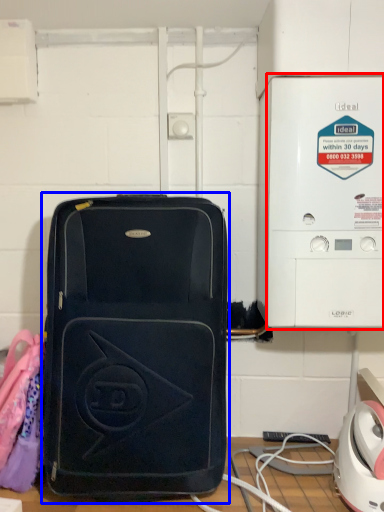
Question: Which point is further to the camera, appliance (highlighted by a red box) or luggage and bags (highlighted by a blue box)?

Choices:
 (A) appliance
 (B) luggage and bags

Answer: (A)